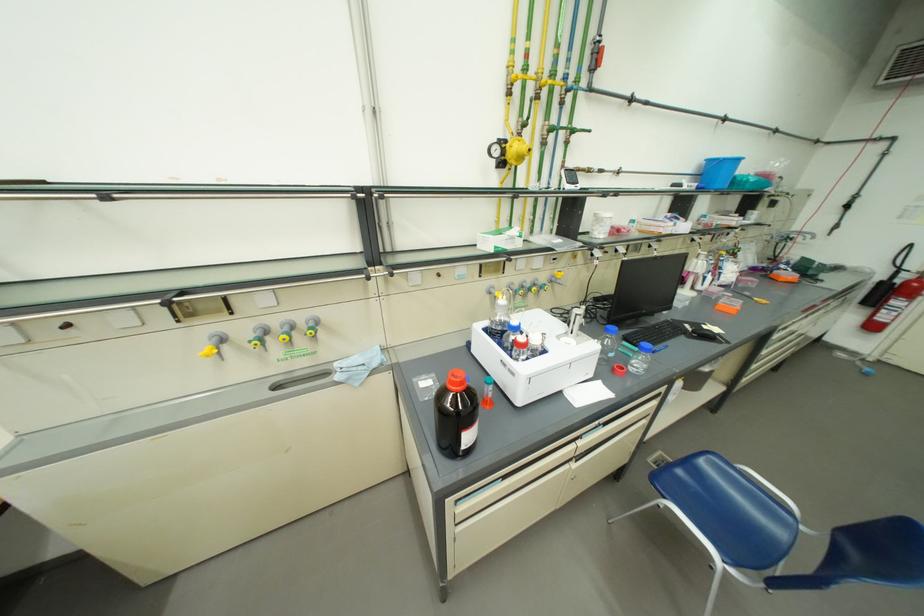
Find the location of a particular element. This screenshot has width=924, height=616. yellow pipe valve is located at coordinates (213, 345).